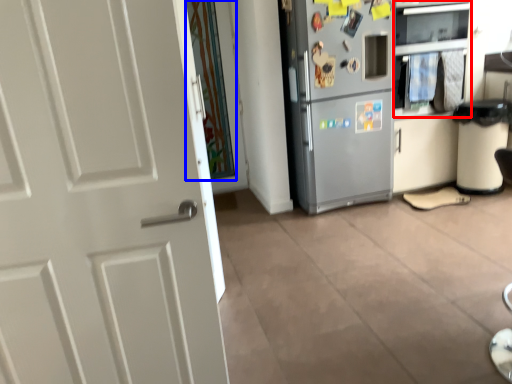
Question: Which point is further to the camera, oven (highlighted by a red box) or glass door (highlighted by a blue box)?

Choices:
 (A) oven
 (B) glass door

Answer: (B)